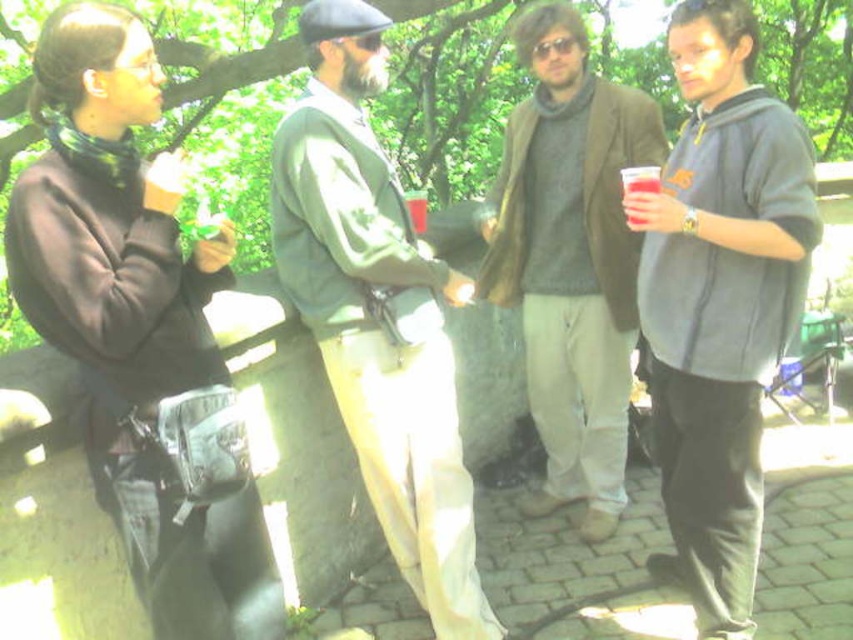
You are standing in the park and see the group of four people. There is a point at coordinates (376, 314). Which person is located at that point?

The point at coordinates (376, 314) corresponds to the green fabric jacket at center.

You are trying to decide which clothing item to take for a walk in the park. Based on the image, which of the following has a larger width and would provide more coverage against the wind? The green fabric jacket at center or the knit sweater at center?

The green fabric jacket at center has a larger width than the knit sweater at center, so it would provide more coverage against the wind.